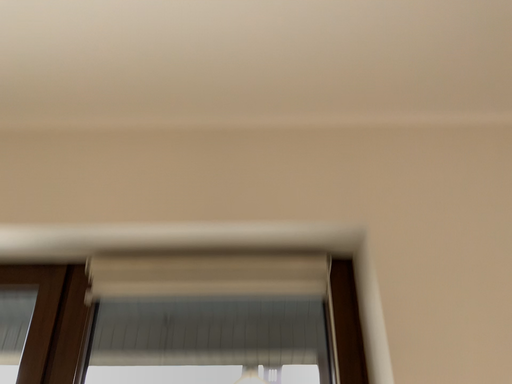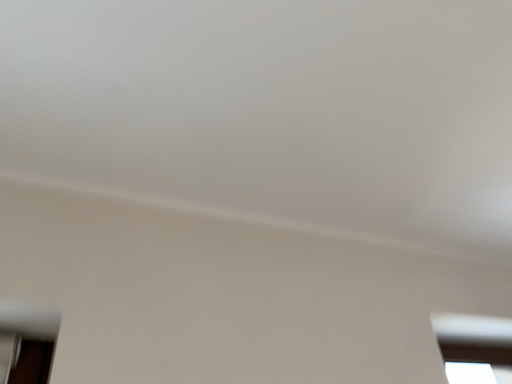
Question: Which way did the camera rotate in the video?

Choices:
 (A) rotated right
 (B) rotated left

Answer: (A)